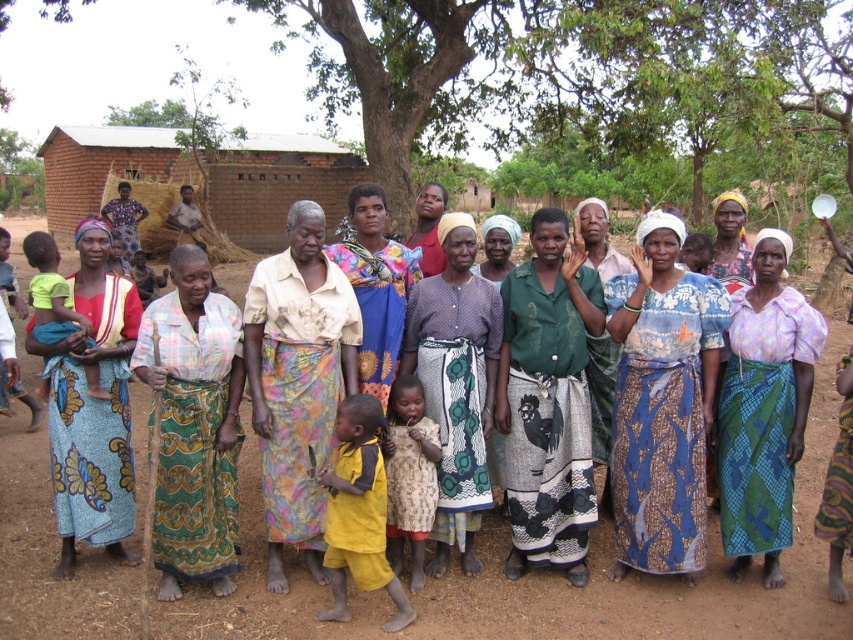
You are a photographer taking a photo of the scene. You notice the printed fabric dress at center and the green textured fabric at center. Which fabric should you focus on first if you want to capture the one that is taller?

The printed fabric dress at center is taller than the green textured fabric at center, so you should focus on the printed fabric dress at center first.

Consider the image. You are a photographer taking a picture of the printed fabric skirt at center and the multicolored fabric dress at center. Which of the two is positioned closer to the camera?

The printed fabric skirt at center is closer to the viewer than the multicolored fabric dress at center, so the skirt would appear larger in the photo.